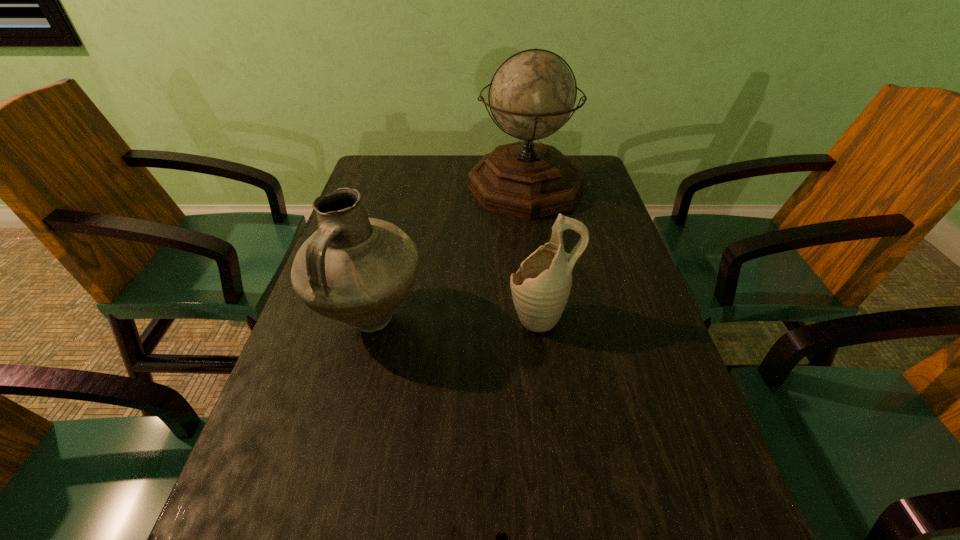
The width and height of the screenshot is (960, 540). I want to click on vacant space located at the spout of the shorter pitcher, so click(x=345, y=318).

At what (x,y) coordinates should I click in order to perform the action: click on object at the far edge. Please return your answer as a coordinate pair (x, y). Looking at the image, I should click on (532, 95).

You are a GUI agent. You are given a task and a screenshot of the screen. Output one action in this format:
    pyautogui.click(x=<x>, y=<y>)
    Task: Click on the object that is at the left edge
    The height and width of the screenshot is (540, 960).
    Given the screenshot: What is the action you would take?
    pyautogui.click(x=354, y=269)

The width and height of the screenshot is (960, 540). What are the coordinates of `object that is at the right edge` in the screenshot? It's located at (532, 95).

The width and height of the screenshot is (960, 540). I want to click on object located in the far right corner section of the desktop, so click(532, 95).

In order to click on free location at the far edge of the desktop in this screenshot , I will do `click(460, 169)`.

In order to click on blank space at the left edge of the desktop in this screenshot , I will do `click(276, 434)`.

This screenshot has width=960, height=540. In order to click on vacant space at the right edge of the desktop in this screenshot , I will do `click(595, 214)`.

Where is `blank space at the far left corner of the desktop`? Image resolution: width=960 pixels, height=540 pixels. blank space at the far left corner of the desktop is located at coordinates (377, 159).

Locate an element on the screen. This screenshot has width=960, height=540. vacant area that lies between the third shortest object and the shorter pitcher is located at coordinates (455, 318).